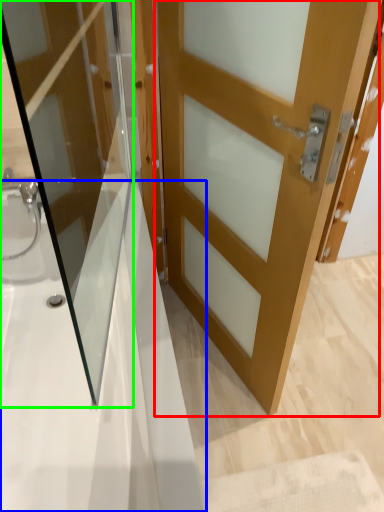
Question: Estimate the real-world distances between objects in this image. Which object is closer to door (highlighted by a red box), bath (highlighted by a blue box) or door (highlighted by a green box)?

Choices:
 (A) bath
 (B) door

Answer: (B)